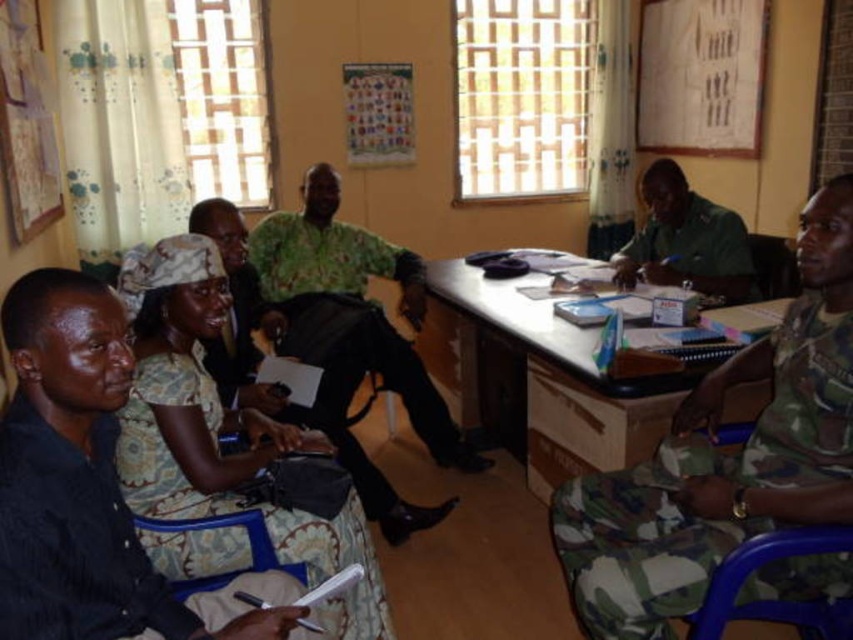
Is point (701, 625) farther from viewer compared to point (231, 579)?

No, (701, 625) is in front of (231, 579).

The height and width of the screenshot is (640, 853). What do you see at coordinates (775, 600) in the screenshot?
I see `blue plastic chair at lower right` at bounding box center [775, 600].

Between point (728, 616) and point (204, 522), which one is positioned behind?

Positioned behind is point (204, 522).

Locate an element on the screen. This screenshot has width=853, height=640. blue plastic chair at lower right is located at coordinates (775, 600).

Between wooden desk at center and blue fabric chair at lower left, which one has more height?

wooden desk at center is taller.

The image size is (853, 640). What do you see at coordinates (558, 378) in the screenshot? I see `wooden desk at center` at bounding box center [558, 378].

Is point (535, 339) positioned behind point (257, 552)?

Yes, it is behind point (257, 552).

Locate an element on the screen. This screenshot has width=853, height=640. wooden desk at center is located at coordinates (558, 378).

Can you confirm if black matte shirt at lower left is smaller than wooden desk at center?

Yes, black matte shirt at lower left is smaller than wooden desk at center.

The image size is (853, 640). What do you see at coordinates (79, 481) in the screenshot?
I see `black matte shirt at lower left` at bounding box center [79, 481].

This screenshot has width=853, height=640. I want to click on black matte shirt at lower left, so click(x=79, y=481).

At what (x,y) coordinates should I click in order to perform the action: click on black matte shirt at lower left. Please return your answer as a coordinate pair (x, y). This screenshot has width=853, height=640. Looking at the image, I should click on (79, 481).